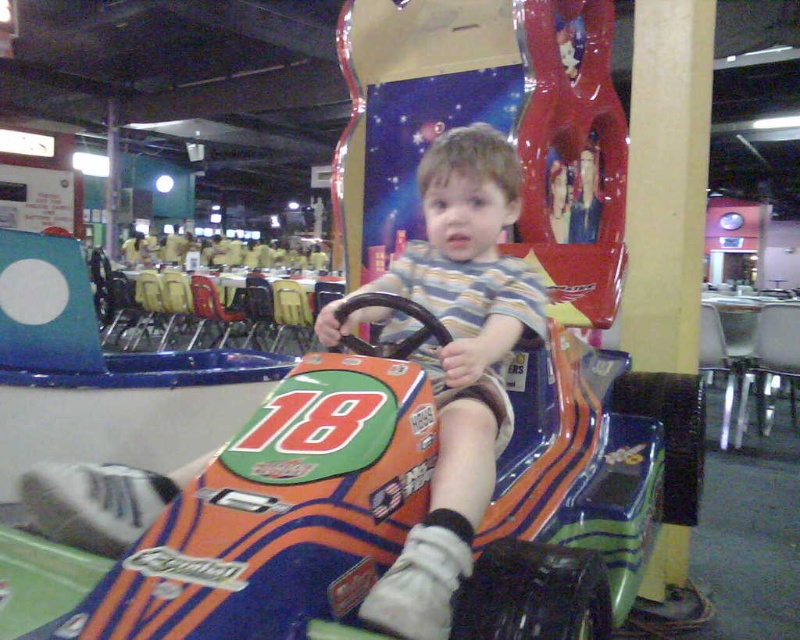
You are a parent trying to decide if your child can safely sit in the orange glossy toy car at center while wearing the striped cotton shirt at center. Considering the size of the car and the shirt, will there be enough space for the child to move comfortably?

The orange glossy toy car at center is wider than the striped cotton shirt at center, so there should be enough space for the child to move comfortably while wearing the striped cotton shirt at center.

You are a parent trying to decide if your child can comfortably sit in the orange glossy toy car at center while wearing the striped cotton shirt at center. Based on the height of the toy car and the shirt, can the child sit without the shirt getting in the way?

The orange glossy toy car at center is not as tall as the striped cotton shirt at center, so the shirt may get in the way when the child sits in the car.

You are navigating a robot through an indoor arcade. The robot needs to reach a charging station located at point 0.802, 0.334. Is the orange glossy toy car at center blocking the path to this point?

The orange glossy toy car at center is located exactly at point (x=266, y=513), so it is directly blocking the path to the charging station at that coordinate.